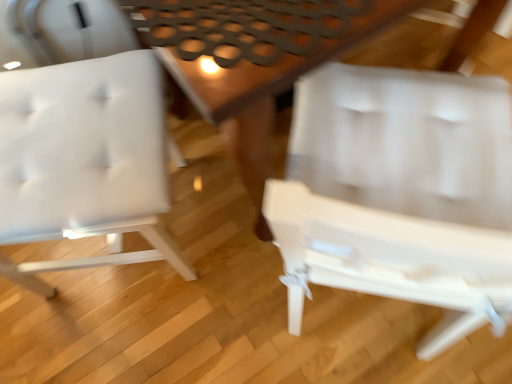
Question: Does white matte chair at left, positioned as the first chair in left-to-right order, have a lesser height compared to wooden table at center?

Choices:
 (A) yes
 (B) no

Answer: (B)

Question: Is white matte chair at left, positioned as the first chair in left-to-right order, thinner than wooden table at center?

Choices:
 (A) no
 (B) yes

Answer: (B)

Question: Is white matte chair at left, which appears as the 2th chair when viewed from the right, placed right next to wooden table at center?

Choices:
 (A) no
 (B) yes

Answer: (A)

Question: Is white matte chair at left, which appears as the 2th chair when viewed from the right, outside of wooden table at center?

Choices:
 (A) no
 (B) yes

Answer: (B)

Question: Does white matte chair at left, which appears as the 2th chair when viewed from the right, have a larger size compared to wooden table at center?

Choices:
 (A) no
 (B) yes

Answer: (A)

Question: Considering the relative positions of white matte chair at left, positioned as the first chair in left-to-right order, and wooden table at center in the image provided, is white matte chair at left, positioned as the first chair in left-to-right order, behind wooden table at center?

Choices:
 (A) no
 (B) yes

Answer: (A)

Question: Is white plastic chair at center, placed as the second chair when sorted from left to right, taller than white matte chair at left, positioned as the first chair in left-to-right order?

Choices:
 (A) yes
 (B) no

Answer: (A)

Question: Is the position of white plastic chair at center, arranged as the first chair when viewed from the right, less distant than that of white matte chair at left, which appears as the 2th chair when viewed from the right?

Choices:
 (A) yes
 (B) no

Answer: (A)

Question: From the image's perspective, does white plastic chair at center, placed as the second chair when sorted from left to right, appear lower than white matte chair at left, which appears as the 2th chair when viewed from the right?

Choices:
 (A) yes
 (B) no

Answer: (A)

Question: Could you tell me if white plastic chair at center, placed as the second chair when sorted from left to right, is facing white matte chair at left, which appears as the 2th chair when viewed from the right?

Choices:
 (A) yes
 (B) no

Answer: (B)

Question: Can you confirm if white plastic chair at center, arranged as the first chair when viewed from the right, is shorter than white matte chair at left, positioned as the first chair in left-to-right order?

Choices:
 (A) no
 (B) yes

Answer: (A)

Question: Does white plastic chair at center, placed as the second chair when sorted from left to right, have a lesser width compared to white matte chair at left, positioned as the first chair in left-to-right order?

Choices:
 (A) no
 (B) yes

Answer: (A)

Question: Is wooden table at center aimed at white plastic chair at center, placed as the second chair when sorted from left to right?

Choices:
 (A) no
 (B) yes

Answer: (B)